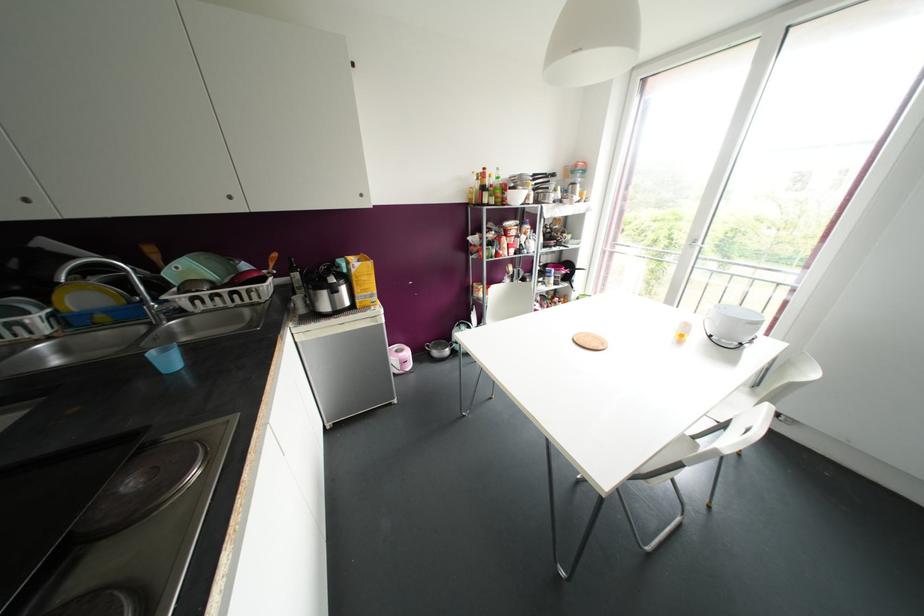
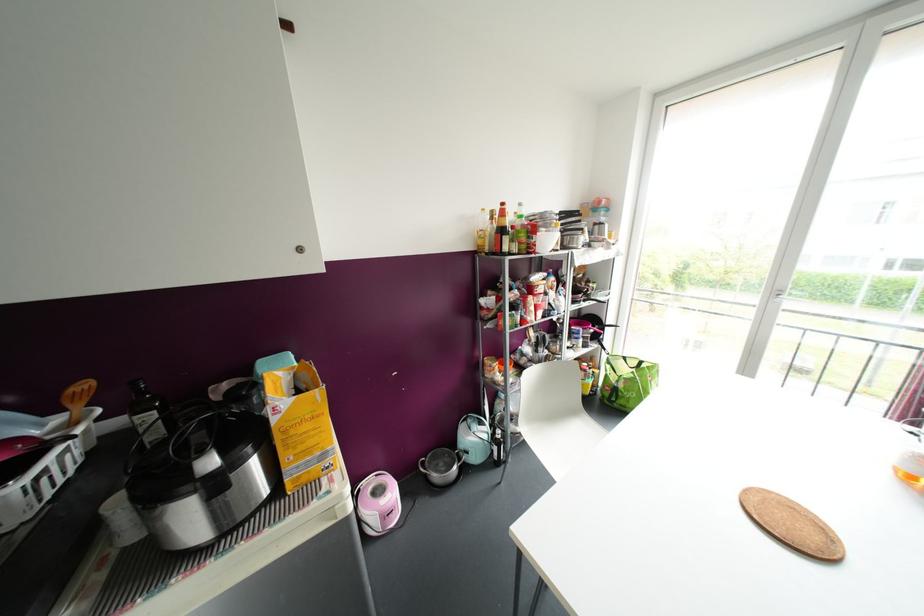
The point at (483, 168) is marked in the first image. Where is the corresponding point in the second image?

(502, 204)